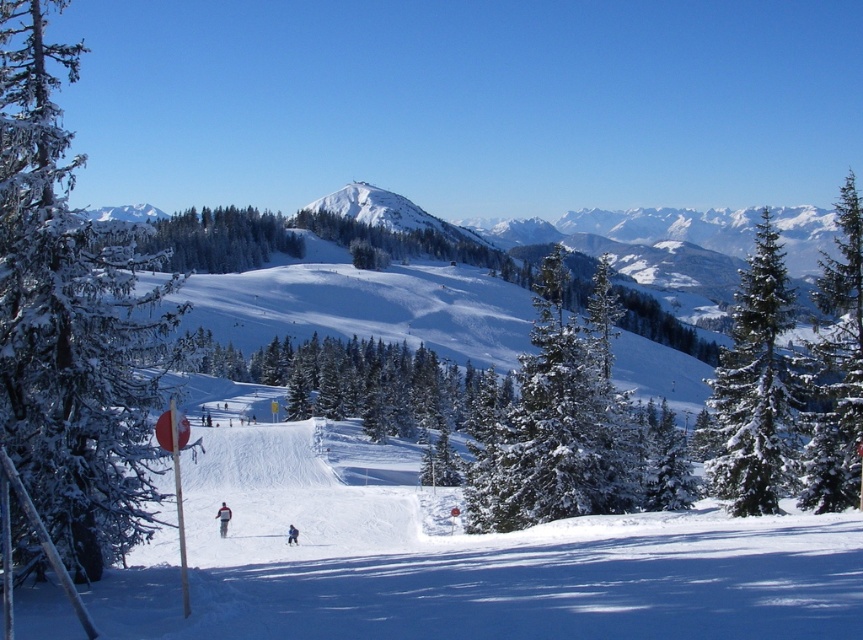
You are planning to set up a small weather station between the green matte tree at center and the green textured pine at center in the winter landscape. The station requires a minimum distance of 150 meters between the two trees to function properly. Based on the scene description, will the weather station work?

The green matte tree at center and green textured pine at center are 184.09 meters apart from each other, which exceeds the required 150 meters. Therefore, the weather station will work.

You are a photographer trying to capture a photo of both the red fabric jacket at center and the blue fabric jacket at center. Since you want them both in the frame, can you tell me which jacket is positioned to the left side of the other?

The red fabric jacket at center is positioned to the left of the blue fabric jacket at center, so to include both in the frame, ensure the red fabric jacket at center is on the left side and the blue fabric jacket at center is on the right side of the photo.

You are a photographer standing at the bottom of the slope. You want to take a photo that includes both the red fabric jacket at center and the blue fabric jacket at center. Which jacket should you adjust your camera angle to focus on first to ensure both are in the frame?

The red fabric jacket at center is below the blue fabric jacket at center, so you should focus on the lower position first to ensure both are visible in the frame.